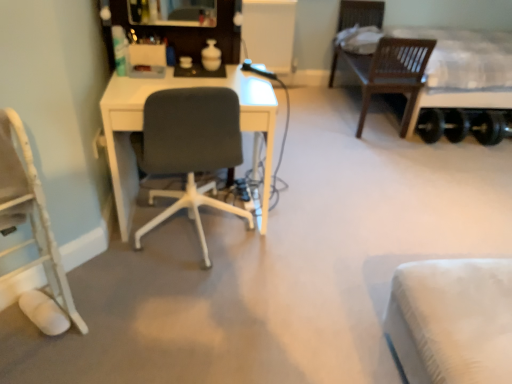
What are the coordinates of `vacant area that lies to the right of matte gray chair at center, acting as the second chair starting from the left` in the screenshot? It's located at (307, 243).